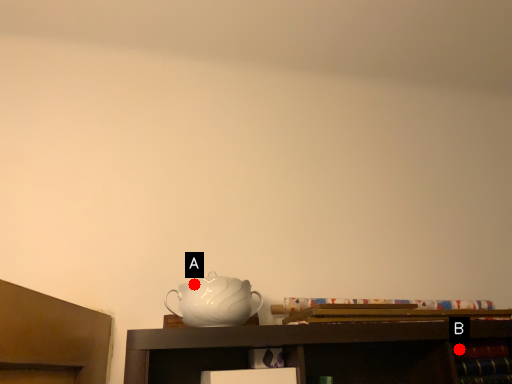
Question: Two points are circled on the image, labeled by A and B beside each circle. Which point is further to the camera?

Choices:
 (A) A is further
 (B) B is further

Answer: (B)